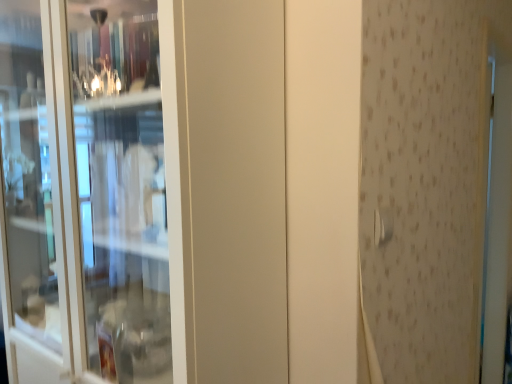
Question: From a real-world perspective, does satin silver door handle at upper right sit lower than transparent glass screen door at left?

Choices:
 (A) yes
 (B) no

Answer: (B)

Question: Is satin silver door handle at upper right next to transparent glass screen door at left and touching it?

Choices:
 (A) yes
 (B) no

Answer: (B)

Question: Does satin silver door handle at upper right have a smaller size compared to transparent glass screen door at left?

Choices:
 (A) no
 (B) yes

Answer: (B)

Question: Can you confirm if satin silver door handle at upper right is wider than transparent glass screen door at left?

Choices:
 (A) yes
 (B) no

Answer: (B)

Question: Is satin silver door handle at upper right thinner than transparent glass screen door at left?

Choices:
 (A) no
 (B) yes

Answer: (B)

Question: From the image's perspective, does satin silver door handle at upper right appear lower than transparent glass screen door at left?

Choices:
 (A) yes
 (B) no

Answer: (A)

Question: Would you consider transparent glass screen door at left to be distant from satin silver door handle at upper right?

Choices:
 (A) yes
 (B) no

Answer: (B)

Question: Considering the relative sizes of transparent glass screen door at left and satin silver door handle at upper right in the image provided, is transparent glass screen door at left bigger than satin silver door handle at upper right?

Choices:
 (A) no
 (B) yes

Answer: (B)

Question: Is transparent glass screen door at left facing towards satin silver door handle at upper right?

Choices:
 (A) no
 (B) yes

Answer: (A)

Question: Considering the relative sizes of transparent glass screen door at left and satin silver door handle at upper right in the image provided, is transparent glass screen door at left wider than satin silver door handle at upper right?

Choices:
 (A) no
 (B) yes

Answer: (B)

Question: Is transparent glass screen door at left closer to camera compared to satin silver door handle at upper right?

Choices:
 (A) yes
 (B) no

Answer: (A)

Question: Is transparent glass screen door at left oriented away from satin silver door handle at upper right?

Choices:
 (A) yes
 (B) no

Answer: (B)

Question: Looking at their shapes, would you say satin silver door handle at upper right is wider or thinner than transparent glass screen door at left?

Choices:
 (A) wide
 (B) thin

Answer: (B)